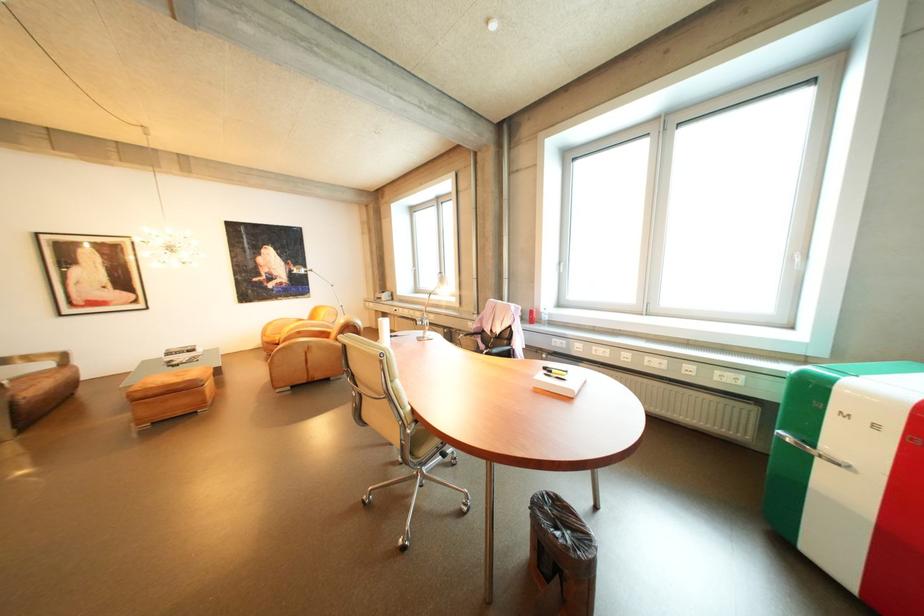
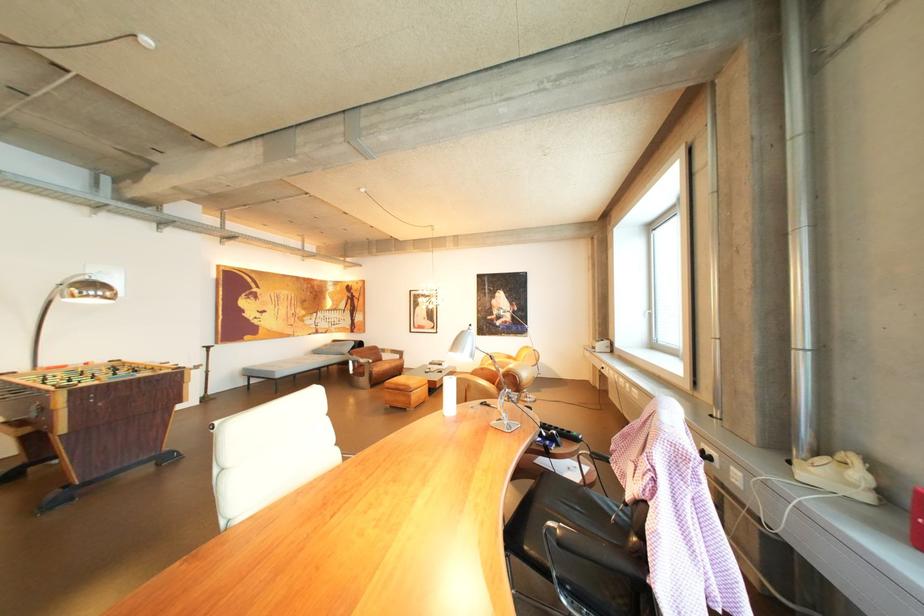
The point at (215, 394) is marked in the first image. Where is the corresponding point in the second image?

(422, 398)